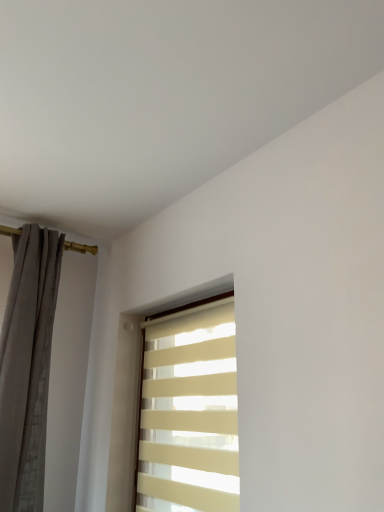
Question: Based on their positions, is beige striped window at center located to the left or right of gray textured curtain at left?

Choices:
 (A) right
 (B) left

Answer: (A)

Question: From the image's perspective, relative to gray textured curtain at left, is beige striped window at center above or below?

Choices:
 (A) above
 (B) below

Answer: (B)

Question: Considering their positions, is beige striped window at center located in front of or behind gray textured curtain at left?

Choices:
 (A) front
 (B) behind

Answer: (A)

Question: In terms of size, does gray textured curtain at left appear bigger or smaller than beige striped window at center?

Choices:
 (A) small
 (B) big

Answer: (B)

Question: In the image, is gray textured curtain at left on the left side or the right side of beige striped window at center?

Choices:
 (A) right
 (B) left

Answer: (B)

Question: From the image's perspective, is gray textured curtain at left positioned above or below beige striped window at center?

Choices:
 (A) below
 (B) above

Answer: (B)

Question: In terms of width, does gray textured curtain at left look wider or thinner when compared to beige striped window at center?

Choices:
 (A) wide
 (B) thin

Answer: (A)